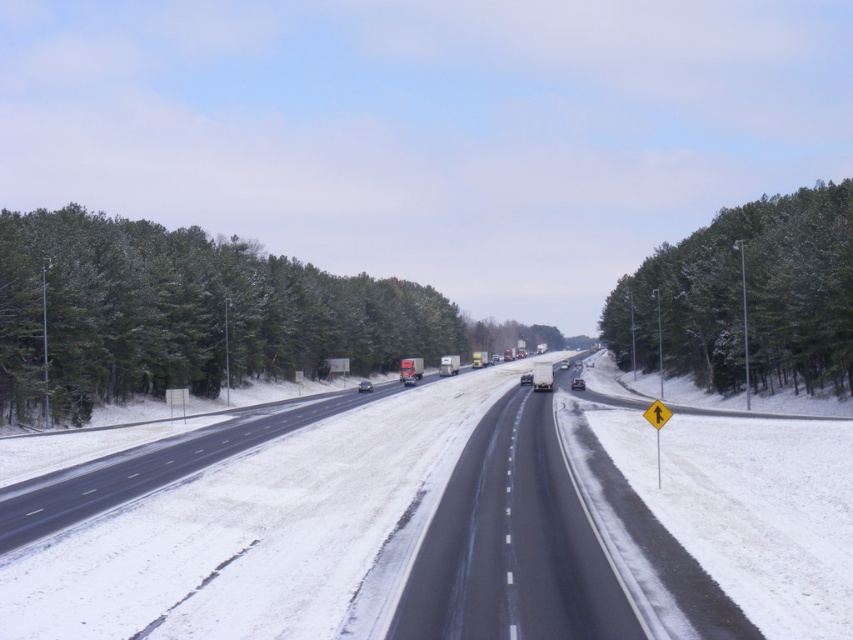
Which is more to the left, green textured trees at left or green textured trees at right?

green textured trees at left

Is green textured trees at left in front of green textured trees at right?

No, green textured trees at left is behind green textured trees at right.

Where is `green textured trees at left`? The width and height of the screenshot is (853, 640). green textured trees at left is located at coordinates (184, 314).

The width and height of the screenshot is (853, 640). Describe the element at coordinates (184, 314) in the screenshot. I see `green textured trees at left` at that location.

I want to click on green textured trees at left, so click(184, 314).

Where is `green textured trees at left`? The image size is (853, 640). green textured trees at left is located at coordinates (184, 314).

What are the coordinates of `green textured trees at left` in the screenshot? It's located at (184, 314).

Does green textured trees at right appear under black asphalt highway at center?

No, green textured trees at right is not below black asphalt highway at center.

What do you see at coordinates (746, 296) in the screenshot? The image size is (853, 640). I see `green textured trees at right` at bounding box center [746, 296].

Where is `green textured trees at right`? This screenshot has height=640, width=853. green textured trees at right is located at coordinates (746, 296).